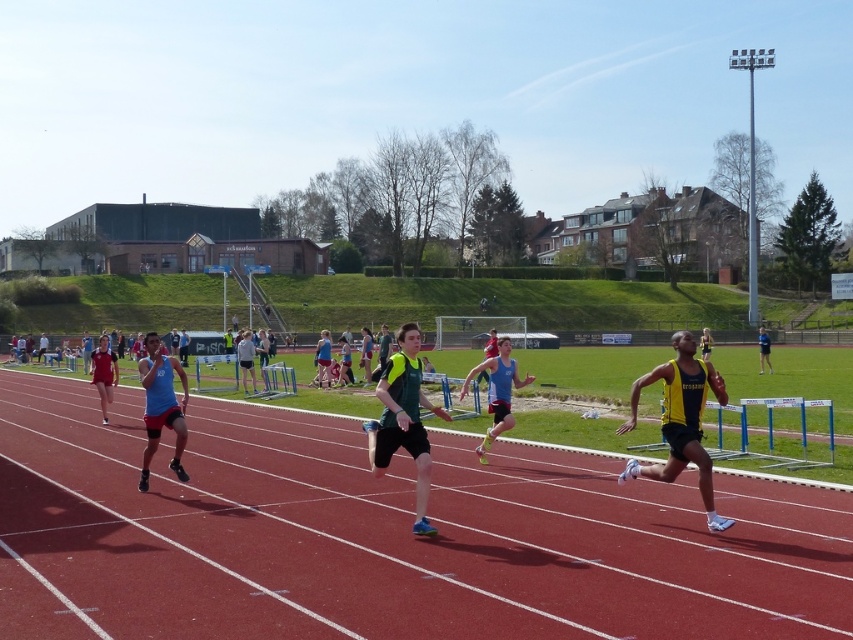
Which is above, yellow/black athletic uniform at right or blue matte tank top at center?

yellow/black athletic uniform at right

The width and height of the screenshot is (853, 640). What do you see at coordinates (680, 420) in the screenshot? I see `yellow/black athletic uniform at right` at bounding box center [680, 420].

The height and width of the screenshot is (640, 853). I want to click on yellow/black athletic uniform at right, so click(680, 420).

Does green/yellow athletic top at center have a smaller size compared to blue fabric running suit at center?

Actually, green/yellow athletic top at center might be larger than blue fabric running suit at center.

Is green/yellow athletic top at center bigger than blue fabric running suit at center?

Indeed, green/yellow athletic top at center has a larger size compared to blue fabric running suit at center.

Is point (370, 422) farther from viewer compared to point (166, 387)?

That is False.

At what (x,y) coordinates should I click in order to perform the action: click on green/yellow athletic top at center. Please return your answer as a coordinate pair (x, y). Looking at the image, I should click on (403, 419).

Is blue fabric running suit at center closer to camera compared to yellow-green jersey at center?

Yes, blue fabric running suit at center is in front of yellow-green jersey at center.

Is blue fabric running suit at center taller than yellow-green jersey at center?

Indeed, blue fabric running suit at center has a greater height compared to yellow-green jersey at center.

The width and height of the screenshot is (853, 640). Identify the location of blue fabric running suit at center. (161, 406).

What are the coordinates of `blue fabric running suit at center` in the screenshot? It's located at (161, 406).